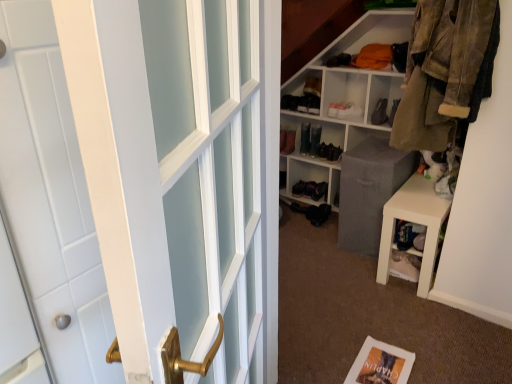
Question: From the image's perspective, is shiny black shoe at center, placed as the 4th shoe when sorted from right to left, located above white cube shelf at upper right?

Choices:
 (A) yes
 (B) no

Answer: (B)

Question: Is shiny black shoe at center, placed as the 4th shoe when sorted from right to left, located outside white cube shelf at upper right?

Choices:
 (A) no
 (B) yes

Answer: (A)

Question: Does shiny black shoe at center, placed as the 4th shoe when sorted from right to left, appear on the right side of white cube shelf at upper right?

Choices:
 (A) yes
 (B) no

Answer: (B)

Question: Does shiny black shoe at center, which ranks as the first shoe in left-to-right order, have a greater height compared to white cube shelf at upper right?

Choices:
 (A) no
 (B) yes

Answer: (A)

Question: Does shiny black shoe at center, placed as the 4th shoe when sorted from right to left, have a smaller size compared to white cube shelf at upper right?

Choices:
 (A) no
 (B) yes

Answer: (B)

Question: Does shiny black shoe at center, which ranks as the first shoe in left-to-right order, have a greater width compared to white cube shelf at upper right?

Choices:
 (A) yes
 (B) no

Answer: (B)

Question: Could you tell me if shiny black boot at center, marked as the third shoe in a right-to-left arrangement, is turned towards shiny black shoe at center, which ranks as the first shoe in left-to-right order?

Choices:
 (A) no
 (B) yes

Answer: (A)

Question: From the image's perspective, is shiny black boot at center, positioned as the 2th shoe in left-to-right order, located above shiny black shoe at center, which ranks as the first shoe in left-to-right order?

Choices:
 (A) no
 (B) yes

Answer: (A)

Question: Is shiny black boot at center, marked as the third shoe in a right-to-left arrangement, placed right next to shiny black shoe at center, placed as the 4th shoe when sorted from right to left?

Choices:
 (A) no
 (B) yes

Answer: (B)

Question: Is shiny black boot at center, positioned as the 2th shoe in left-to-right order, looking in the opposite direction of shiny black shoe at center, which ranks as the first shoe in left-to-right order?

Choices:
 (A) yes
 (B) no

Answer: (B)

Question: Is shiny black boot at center, marked as the third shoe in a right-to-left arrangement, closer to the viewer compared to shiny black shoe at center, placed as the 4th shoe when sorted from right to left?

Choices:
 (A) yes
 (B) no

Answer: (A)

Question: From a real-world perspective, is shiny black boot at center, positioned as the 2th shoe in left-to-right order, below shiny black shoe at center, placed as the 4th shoe when sorted from right to left?

Choices:
 (A) yes
 (B) no

Answer: (A)

Question: Are matte black boot at upper center, which ranks as the 2th shoe in right-to-left order, and white matte bookshelf at center beside each other?

Choices:
 (A) yes
 (B) no

Answer: (B)